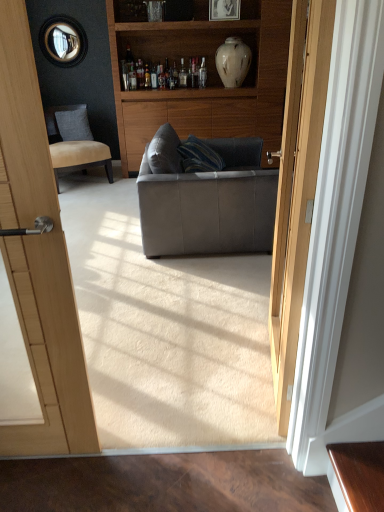
Question: Is white glossy vase at upper center in front of or behind wooden cabinet at center in the image?

Choices:
 (A) front
 (B) behind

Answer: (B)

Question: From their relative heights in the image, would you say white glossy vase at upper center is taller or shorter than wooden cabinet at center?

Choices:
 (A) short
 (B) tall

Answer: (A)

Question: Which object is the farthest from the leather couch at center?

Choices:
 (A) wooden cabinet at center
 (B) matte black picture frame at upper center
 (C) suede tan chair at left
 (D) white glossy vase at upper center
 (E) gray fabric pillow at left

Answer: (E)

Question: Estimate the real-world distances between objects in this image. Which object is closer to the wooden cabinet at center?

Choices:
 (A) white glossy vase at upper center
 (B) suede tan chair at left
 (C) matte black picture frame at upper center
 (D) leather couch at center
 (E) gray fabric pillow at left

Answer: (A)